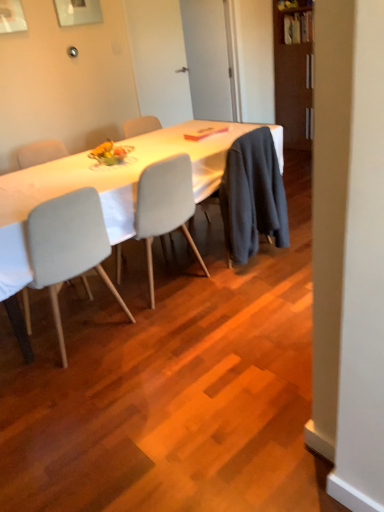
Question: In which direction should I rotate to look at metallic silver picture frame at upper center?

Choices:
 (A) left
 (B) right

Answer: (A)

Question: Considering the relative positions of light gray fabric chair at center, which ranks as the 2th chair in left-to-right order, and matte white plate at center in the image provided, is light gray fabric chair at center, which ranks as the 2th chair in left-to-right order, to the left of matte white plate at center from the viewer's perspective?

Choices:
 (A) yes
 (B) no

Answer: (B)

Question: Is light gray fabric chair at center, which ranks as the 1th chair in right-to-left order, wider than matte white plate at center?

Choices:
 (A) yes
 (B) no

Answer: (A)

Question: Does light gray fabric chair at center, which ranks as the 1th chair in right-to-left order, come behind matte white plate at center?

Choices:
 (A) no
 (B) yes

Answer: (A)

Question: Is light gray fabric chair at center, which ranks as the 1th chair in right-to-left order, positioned in front of matte white plate at center?

Choices:
 (A) no
 (B) yes

Answer: (B)

Question: Does light gray fabric chair at center, which ranks as the 1th chair in right-to-left order, have a greater height compared to matte white plate at center?

Choices:
 (A) no
 (B) yes

Answer: (B)

Question: Is light gray fabric chair at center, which ranks as the 2th chair in left-to-right order, facing towards matte white plate at center?

Choices:
 (A) yes
 (B) no

Answer: (A)

Question: Is matte white plate at center not inside brown wooden bookshelf at upper right?

Choices:
 (A) yes
 (B) no

Answer: (A)

Question: From a real-world perspective, is matte white plate at center on brown wooden bookshelf at upper right?

Choices:
 (A) yes
 (B) no

Answer: (B)

Question: Are matte white plate at center and brown wooden bookshelf at upper right making contact?

Choices:
 (A) yes
 (B) no

Answer: (B)

Question: Are matte white plate at center and brown wooden bookshelf at upper right located far from each other?

Choices:
 (A) no
 (B) yes

Answer: (B)

Question: Is matte white plate at center oriented towards brown wooden bookshelf at upper right?

Choices:
 (A) no
 (B) yes

Answer: (B)

Question: Does matte white plate at center have a lesser height compared to brown wooden bookshelf at upper right?

Choices:
 (A) no
 (B) yes

Answer: (B)

Question: Is matte white plate at center placed right next to metallic silver picture frame at upper center?

Choices:
 (A) no
 (B) yes

Answer: (A)